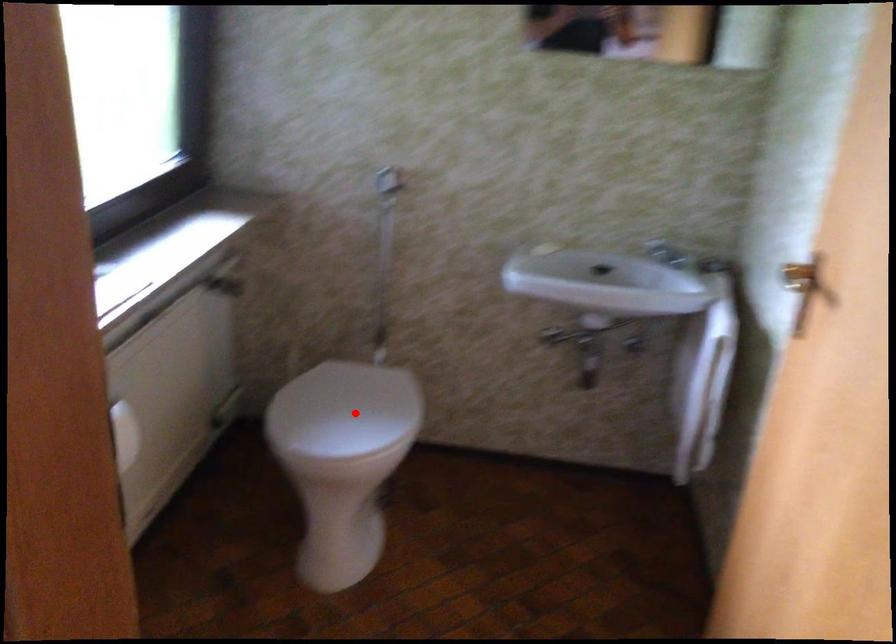
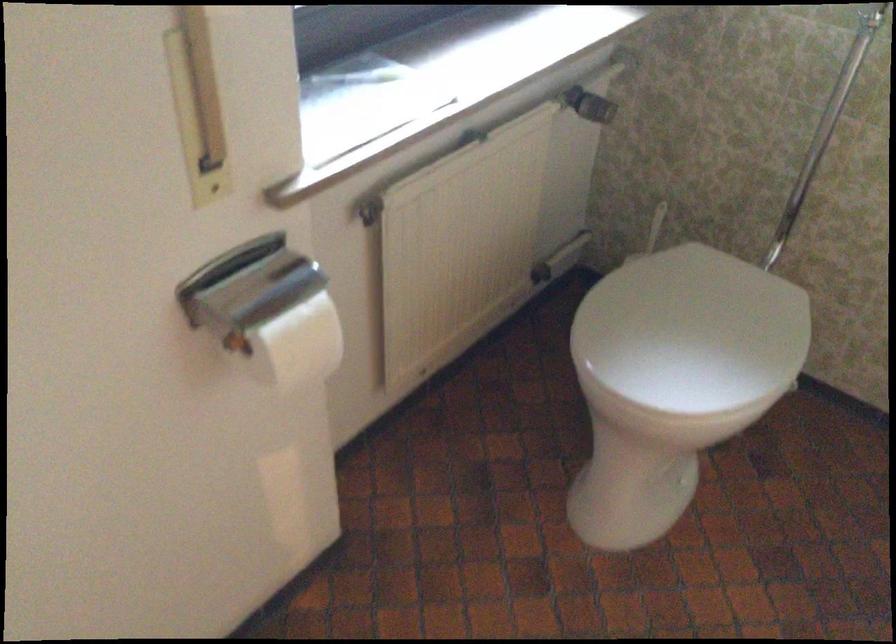
Question: A red point is marked in image1. In image2, is the corresponding 3D point closer to the camera or farther? Reply with the corresponding letter.

Choices:
 (A) The corresponding 3D point is closer.
 (B) The corresponding 3D point is farther.

Answer: (A)